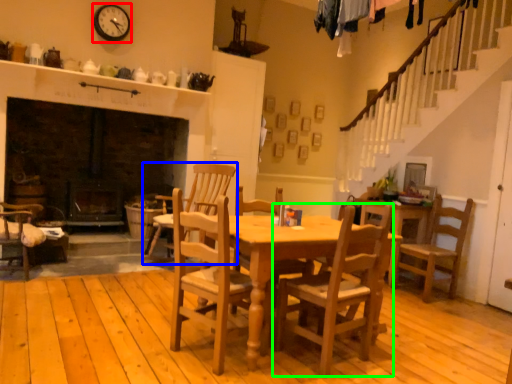
Question: Based on their relative distances, which object is nearer to clock (highlighted by a red box)? Choose from chair (highlighted by a blue box) and chair (highlighted by a green box).

Choices:
 (A) chair
 (B) chair

Answer: (A)